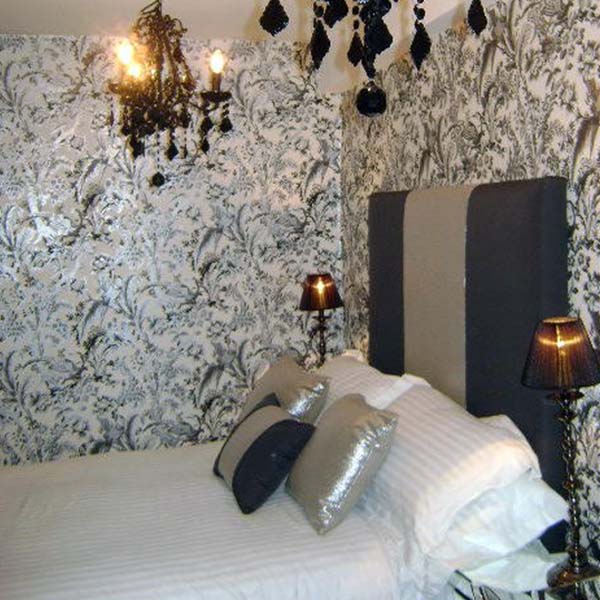
What are the coordinates of `bed` in the screenshot? It's located at (191, 555).